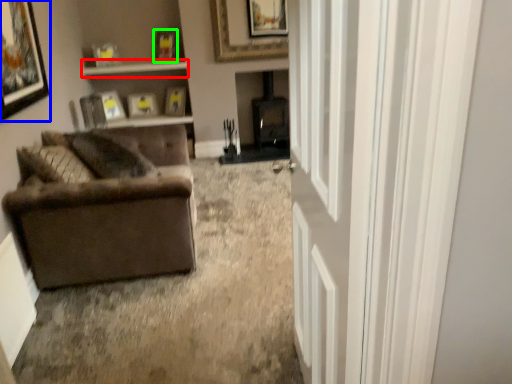
Question: Which is nearer to the window sill (highlighted by a red box)? picture frame (highlighted by a blue box) or picture frame (highlighted by a green box).

Choices:
 (A) picture frame
 (B) picture frame

Answer: (B)